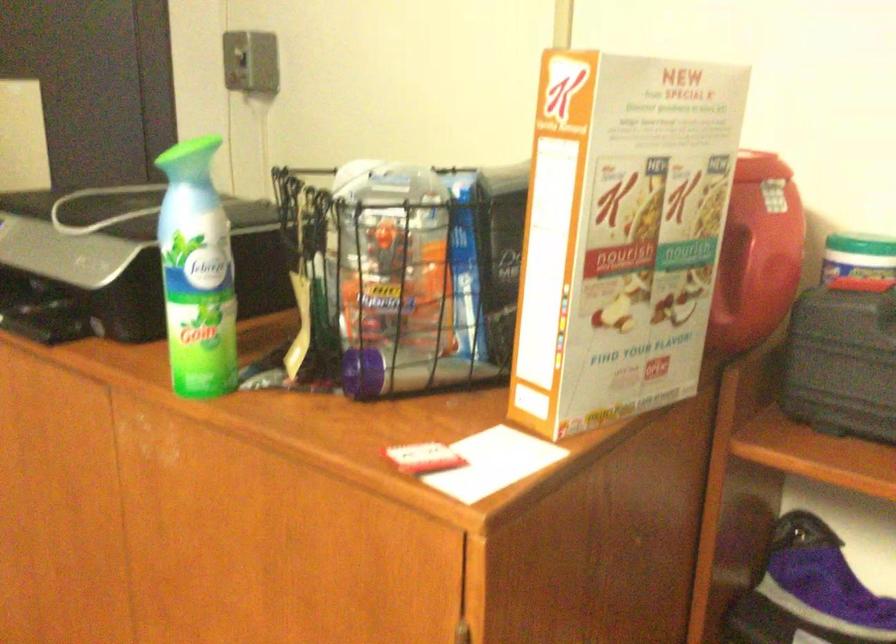
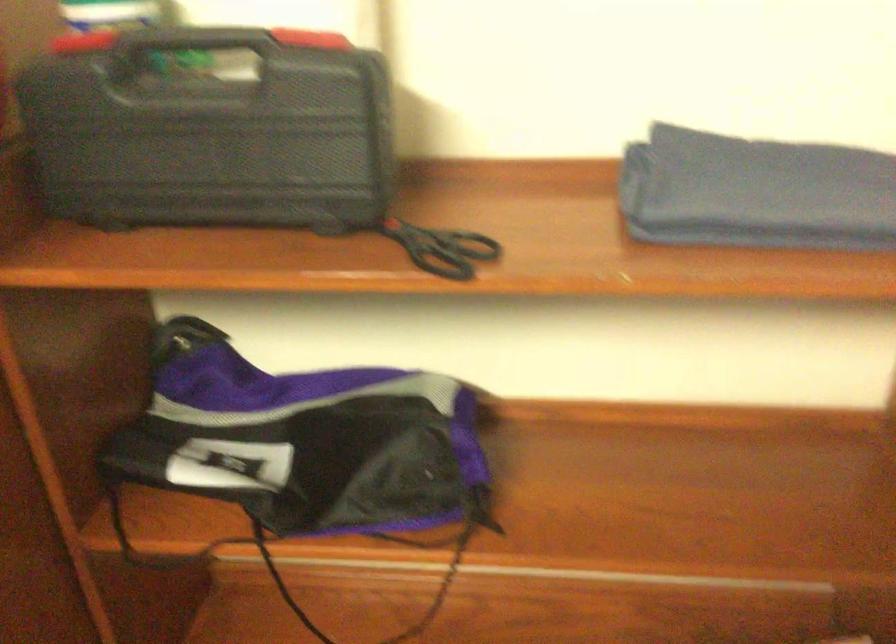
In the scene shown: How did the camera likely rotate?

The rotation direction of the camera is right-down.